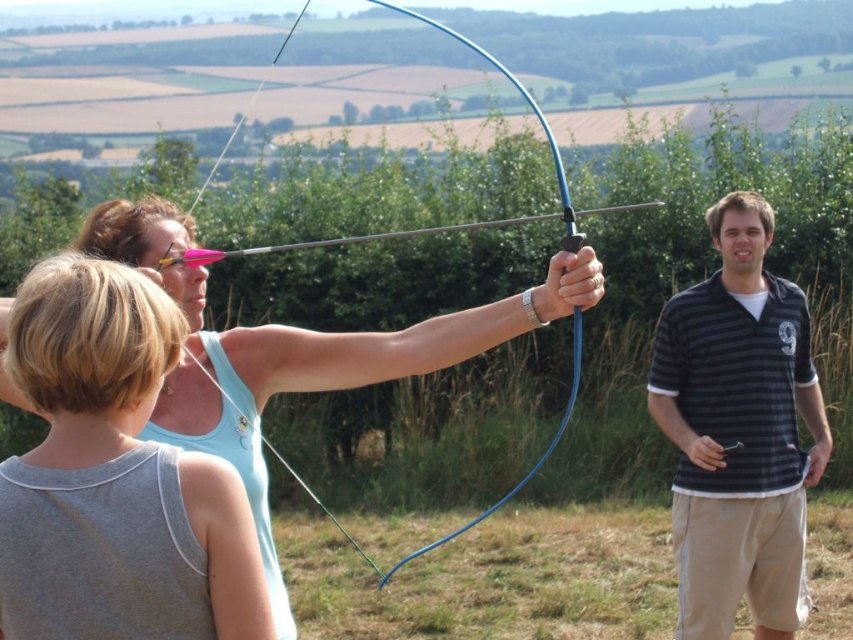
Can you confirm if light blue tank top at center is wider than blue rubber bow at center?

In fact, light blue tank top at center might be narrower than blue rubber bow at center.

Does light blue tank top at center appear over blue rubber bow at center?

Incorrect, light blue tank top at center is not positioned above blue rubber bow at center.

Describe the element at coordinates (132, 419) in the screenshot. I see `light blue tank top at center` at that location.

You are a GUI agent. You are given a task and a screenshot of the screen. Output one action in this format:
    pyautogui.click(x=<x>, y=<y>)
    Task: Click on the light blue tank top at center
    This screenshot has width=853, height=640.
    Given the screenshot: What is the action you would take?
    pyautogui.click(x=132, y=419)

Between black striped polo shirt at right and matte blue bow at center, which one has less height?

With less height is matte blue bow at center.

This screenshot has height=640, width=853. What do you see at coordinates (738, 432) in the screenshot?
I see `black striped polo shirt at right` at bounding box center [738, 432].

Which is behind, point (706, 412) or point (254, 394)?

Point (706, 412)

Where is `black striped polo shirt at right`? This screenshot has height=640, width=853. black striped polo shirt at right is located at coordinates (738, 432).

Is matte blue bow at center bigger than blue rubber bow at center?

No, matte blue bow at center is not bigger than blue rubber bow at center.

Is matte blue bow at center to the left of blue rubber bow at center from the viewer's perspective?

Yes, matte blue bow at center is to the left of blue rubber bow at center.

This screenshot has height=640, width=853. What are the coordinates of `matte blue bow at center` in the screenshot? It's located at (296, 349).